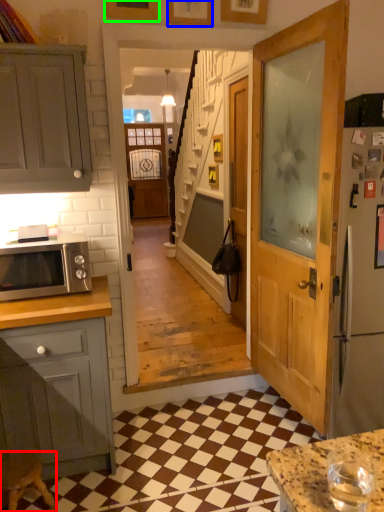
Question: Which is nearer to the stool (highlighted by a red box)? picture frame (highlighted by a blue box) or picture frame (highlighted by a green box).

Choices:
 (A) picture frame
 (B) picture frame

Answer: (B)